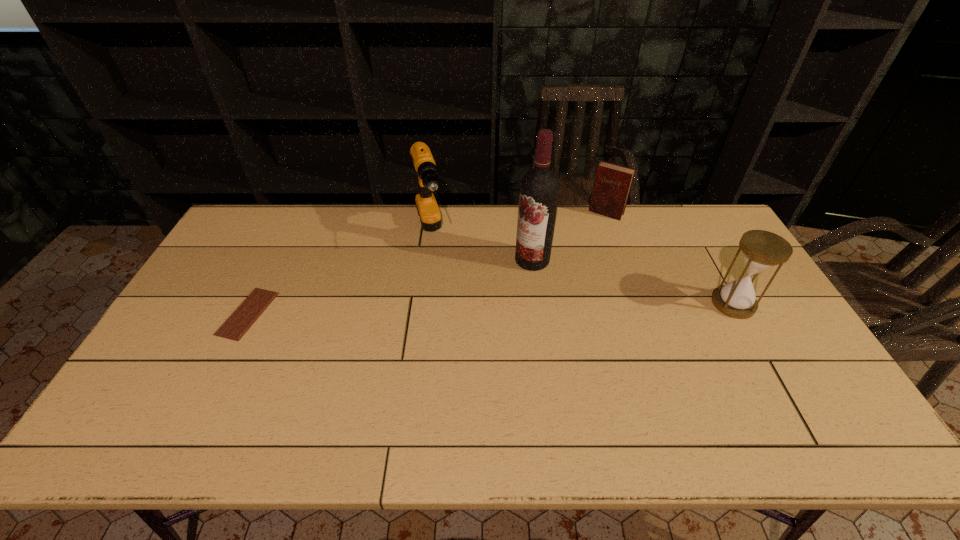
The image size is (960, 540). What are the coordinates of `object that is the closest to the third shortest object` in the screenshot? It's located at (612, 184).

I want to click on vacant space that satisfies the following two spatial constraints: 1. on the front side of the fourth shortest object; 2. on the right side of the third object from right to left, so click(427, 260).